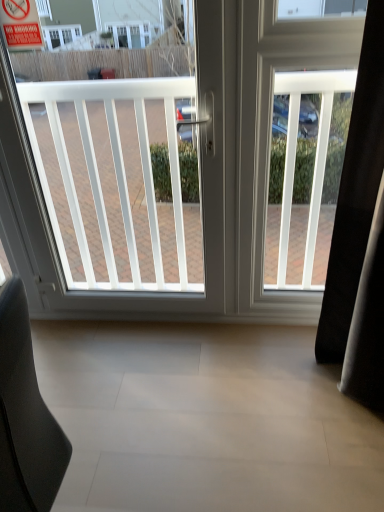
In order to click on black leather chair at lower left in this screenshot , I will do [25, 416].

Measure the distance between point (298, 109) and camera.

Point (298, 109) and camera are 5.90 feet apart from each other.

The height and width of the screenshot is (512, 384). Find the location of `red plastic sign at upper left`. red plastic sign at upper left is located at coordinates (21, 24).

Which object is positioned more to the right, white plastic window at center or white plastic screen door at right?

Positioned to the right is white plastic screen door at right.

From their relative heights in the image, would you say white plastic window at center is taller or shorter than white plastic screen door at right?

In the image, white plastic window at center appears to be taller than white plastic screen door at right.

Are white plastic window at center and white plastic screen door at right beside each other?

white plastic window at center and white plastic screen door at right are clearly separated.

Based on the photo, which object is thinner, red plastic sign at upper left or white plastic window at center?

Thinner between the two is red plastic sign at upper left.

How different are the orientations of red plastic sign at upper left and white plastic window at center in degrees?

The facing directions of red plastic sign at upper left and white plastic window at center are 0.00339 degrees apart.

Considering the sizes of objects red plastic sign at upper left and white plastic window at center in the image provided, who is taller, red plastic sign at upper left or white plastic window at center?

With more height is white plastic window at center.

At what (x,y) coordinates should I click in order to perform the action: click on parking sign to the left of white plastic window at center. Please return your answer as a coordinate pair (x, y). Looking at the image, I should click on click(x=21, y=24).

Is red plastic sign at upper left touching white plastic screen door at right?

No, red plastic sign at upper left is not making contact with white plastic screen door at right.

Where is `screen door below the red plastic sign at upper left (from a real-world perspective)`? screen door below the red plastic sign at upper left (from a real-world perspective) is located at coordinates 287,144.

Which object is further away from the camera taking this photo, red plastic sign at upper left or white plastic screen door at right?

white plastic screen door at right is further away from the camera.

Which of these two, red plastic sign at upper left or black leather chair at lower left, is wider?

Wider between the two is black leather chair at lower left.

The image size is (384, 512). Identify the location of parking sign above the black leather chair at lower left (from a real-world perspective). (21, 24).

Which of these two, red plastic sign at upper left or black leather chair at lower left, is bigger?

With larger size is black leather chair at lower left.

From the image's perspective, is red plastic sign at upper left located beneath black leather chair at lower left?

Actually, red plastic sign at upper left appears above black leather chair at lower left in the image.

Is white plastic screen door at right far from red plastic sign at upper left?

white plastic screen door at right is far away from red plastic sign at upper left.

In terms of width, does white plastic screen door at right look wider or thinner when compared to red plastic sign at upper left?

In the image, white plastic screen door at right appears to be wider than red plastic sign at upper left.

Which object is positioned more to the left, white plastic screen door at right or red plastic sign at upper left?

Positioned to the left is red plastic sign at upper left.

Which object is further away from the camera, white plastic screen door at right or red plastic sign at upper left?

white plastic screen door at right is more distant.

Which of these two, black leather chair at lower left or white plastic screen door at right, is bigger?

black leather chair at lower left.

Is black leather chair at lower left positioned in front of white plastic screen door at right?

Yes, black leather chair at lower left is closer to the camera.

Where is `furniture below the white plastic screen door at right (from a real-world perspective)`? furniture below the white plastic screen door at right (from a real-world perspective) is located at coordinates (25, 416).

Are black leather chair at lower left and white plastic screen door at right beside each other?

No.

Considering the relative positions of white plastic screen door at right and white plastic window at center in the image provided, is white plastic screen door at right to the left of white plastic window at center from the viewer's perspective?

Incorrect, white plastic screen door at right is not on the left side of white plastic window at center.

Would you consider white plastic screen door at right to be distant from white plastic window at center?

No, white plastic screen door at right is in close proximity to white plastic window at center.

Does point (242, 157) appear closer or farther from the camera than point (150, 204)?

Point (242, 157) is positioned closer to the camera compared to point (150, 204).

At what (x,y) coordinates should I click in order to perform the action: click on screen door behind the white plastic window at center. Please return your answer as a coordinate pair (x, y). The image size is (384, 512). Looking at the image, I should click on (287, 144).

This screenshot has width=384, height=512. In the image, there is a white plastic window at center. Find the location of `parking sign above it (from the image's perspective)`. parking sign above it (from the image's perspective) is located at coordinates (21, 24).

Which object lies nearer to the anchor point red plastic sign at upper left, black leather chair at lower left or white plastic screen door at right?

Based on the image, white plastic screen door at right appears to be nearer to red plastic sign at upper left.

When comparing their distances from white plastic window at center, does white plastic screen door at right or red plastic sign at upper left seem closer?

Among the two, white plastic screen door at right is located nearer to white plastic window at center.

Looking at the image, which one is located closer to black leather chair at lower left, white plastic screen door at right or white plastic window at center?

The object closer to black leather chair at lower left is white plastic window at center.

Looking at the image, which one is located closer to white plastic screen door at right, red plastic sign at upper left or black leather chair at lower left?

red plastic sign at upper left lies closer to white plastic screen door at right than the other object.

Which object lies further to the anchor point white plastic screen door at right, black leather chair at lower left or red plastic sign at upper left?

black leather chair at lower left.

From the image, which object appears to be nearer to red plastic sign at upper left, white plastic screen door at right or white plastic window at center?

The object closer to red plastic sign at upper left is white plastic window at center.

From the picture: From the image, which object appears to be farther from white plastic window at center, black leather chair at lower left or white plastic screen door at right?

black leather chair at lower left lies further to white plastic window at center than the other object.

Considering their positions, is white plastic window at center positioned further to white plastic screen door at right than red plastic sign at upper left?

red plastic sign at upper left.

Where is `window between black leather chair at lower left and white plastic screen door at right from front to back`? window between black leather chair at lower left and white plastic screen door at right from front to back is located at coordinates (179, 175).

The image size is (384, 512). I want to click on window between red plastic sign at upper left and white plastic screen door at right in the horizontal direction, so click(x=179, y=175).

Find the location of `window that lies between red plastic sign at upper left and black leather chair at lower left from top to bottom`. window that lies between red plastic sign at upper left and black leather chair at lower left from top to bottom is located at coordinates (179, 175).

At what (x,y) coordinates should I click in order to perform the action: click on screen door between red plastic sign at upper left and black leather chair at lower left in the up-down direction. Please return your answer as a coordinate pair (x, y). Looking at the image, I should click on (287, 144).